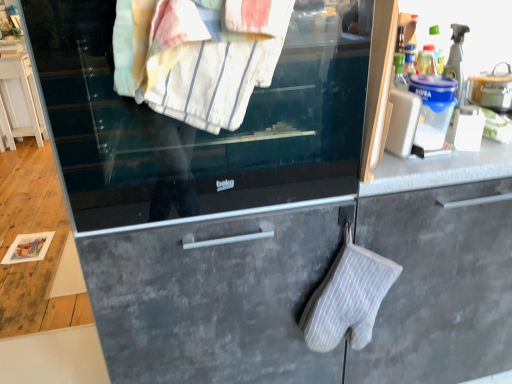
Where is `vacant space to the right of white plastic phone at upper right`? vacant space to the right of white plastic phone at upper right is located at coordinates (458, 155).